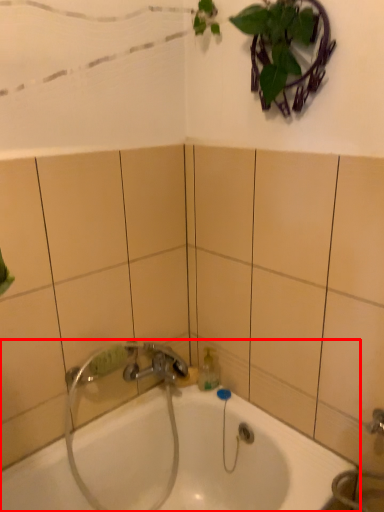
Question: Considering the relative positions of bathtub (annotated by the red box) and plumbing fixture in the image provided, where is bathtub (annotated by the red box) located with respect to the staircase?

Choices:
 (A) right
 (B) left

Answer: (A)